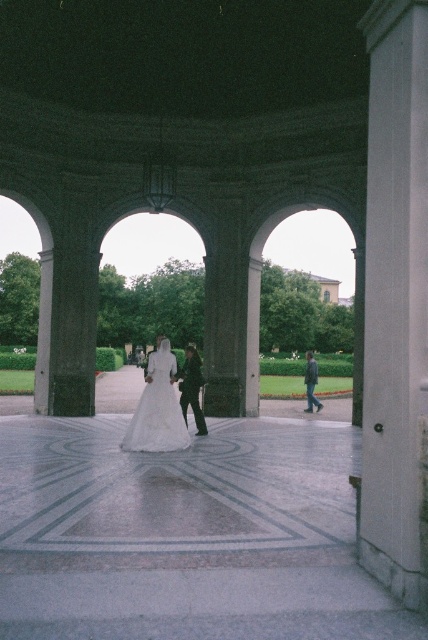
You are a photographer planning to capture a full body shot of the white satin dress at center without any obstructions. Considering the white smooth pillar at right, will the pillar block the view of the dress from where you are standing?

The white smooth pillar at right is taller than the white satin dress at center, so the pillar might block the view of the dress if positioned too close or directly behind it. Adjust your angle to ensure the dress remains visible.

You are a photographer positioned at the camera location. You want to take a photo that includes both the point at coordinate (389, 115) and the point at coordinate (143, 442). Which point will appear larger in the photo?

Point at coordinate (389, 115) will appear larger in the photo because it is closer to the camera than point at coordinate (143, 442).

You are a photographer setting up for a wedding photoshoot at this location. You need to ensure that the white satin dress at center and the dark green fabric jacket at center are both visible in the frame. Given their heights, which one might require you to adjust your camera angle to capture fully?

The white satin dress at center has a greater height compared to the dark green fabric jacket at center, so you may need to adjust your camera angle to ensure the taller white satin dress at center is fully captured in the frame.